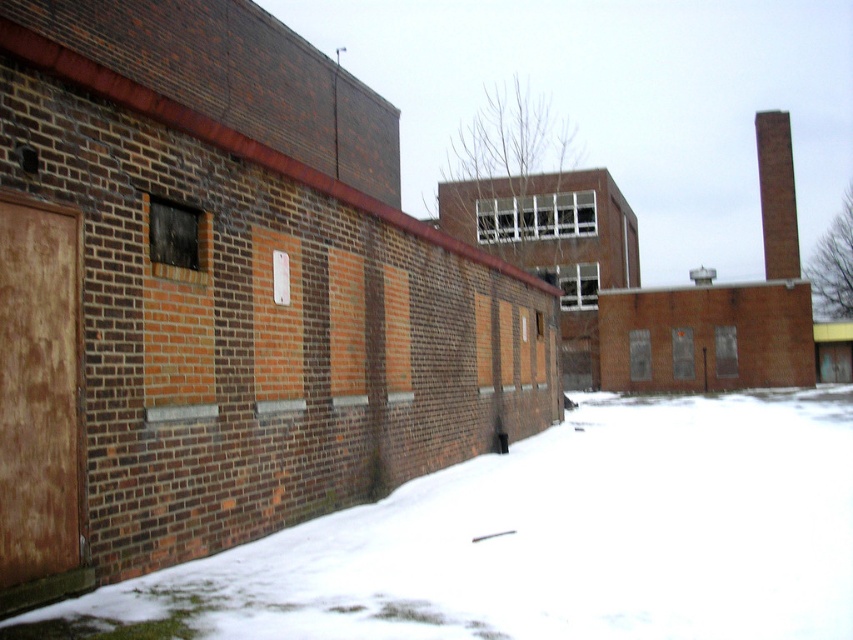
Question: Which point is farther to the camera?

Choices:
 (A) (668, 540)
 (B) (767, 209)

Answer: (B)

Question: Which point is farther from the camera taking this photo?

Choices:
 (A) (352, 612)
 (B) (773, 122)

Answer: (B)

Question: Where is white powdery snow at lower left located in relation to brown brick chimney at upper right in the image?

Choices:
 (A) below
 (B) above

Answer: (A)

Question: Does white powdery snow at lower left appear on the right side of brown brick chimney at upper right?

Choices:
 (A) no
 (B) yes

Answer: (A)

Question: Does white powdery snow at lower left appear under brown brick chimney at upper right?

Choices:
 (A) yes
 (B) no

Answer: (A)